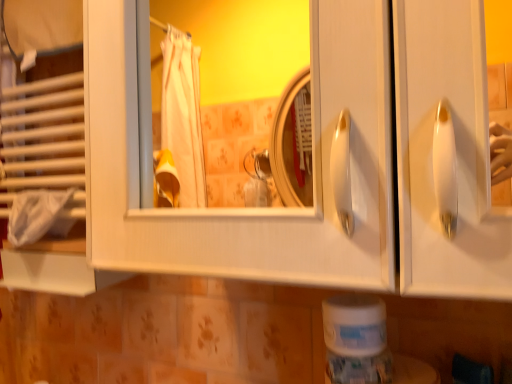
Question: Is white fabric bath towel at left inside the boundaries of white matte toilet paper at lower center, or outside?

Choices:
 (A) outside
 (B) inside

Answer: (A)

Question: Considering the positions of white fabric bath towel at left and white matte toilet paper at lower center in the image, is white fabric bath towel at left taller or shorter than white matte toilet paper at lower center?

Choices:
 (A) tall
 (B) short

Answer: (A)

Question: Is point (29, 203) positioned closer to the camera than point (355, 324)?

Choices:
 (A) farther
 (B) closer

Answer: (A)

Question: In terms of width, does white matte toilet paper at lower center look wider or thinner when compared to white fabric bath towel at left?

Choices:
 (A) thin
 (B) wide

Answer: (B)

Question: From a real-world perspective, relative to white fabric bath towel at left, is white matte toilet paper at lower center vertically above or below?

Choices:
 (A) below
 (B) above

Answer: (A)

Question: In terms of size, does white matte toilet paper at lower center appear bigger or smaller than white fabric bath towel at left?

Choices:
 (A) small
 (B) big

Answer: (A)

Question: Which is correct: white matte toilet paper at lower center is inside white fabric bath towel at left, or outside of it?

Choices:
 (A) inside
 (B) outside

Answer: (B)